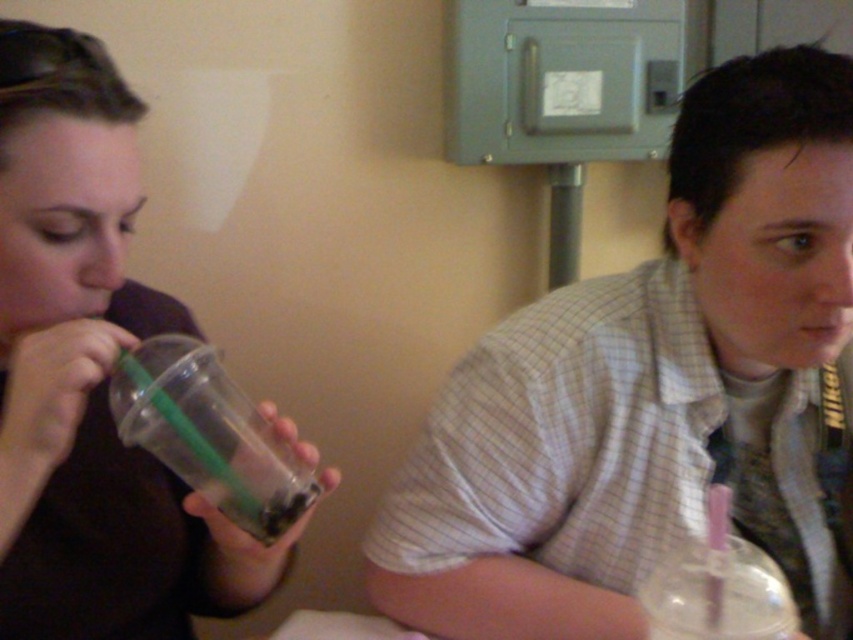
Between matte plastic cup at right and transparent plastic cup at left, which one has more height?

Standing taller between the two is matte plastic cup at right.

Is point (775, 273) positioned after point (146, 499)?

No, it is in front of (146, 499).

Locate an element on the screen. This screenshot has width=853, height=640. matte plastic cup at right is located at coordinates (653, 390).

Does matte plastic cup at right have a greater width compared to clear plastic cup at lower right?

Correct, the width of matte plastic cup at right exceeds that of clear plastic cup at lower right.

Is matte plastic cup at right below clear plastic cup at lower right?

No, matte plastic cup at right is not below clear plastic cup at lower right.

Who is more forward, (776,224) or (772,609)?

Point (772,609) is in front.

Identify the location of matte plastic cup at right. (653, 390).

Does transparent plastic cup at left have a smaller size compared to clear plastic cup at left?

Actually, transparent plastic cup at left might be larger than clear plastic cup at left.

Can you confirm if transparent plastic cup at left is taller than clear plastic cup at left?

Yes.

The width and height of the screenshot is (853, 640). Identify the location of transparent plastic cup at left. (90, 374).